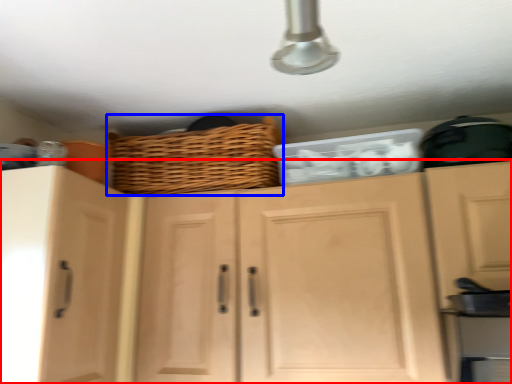
Question: Which object appears closest to the camera in this image, cabinetry (highlighted by a red box) or basket (highlighted by a blue box)?

Choices:
 (A) cabinetry
 (B) basket

Answer: (A)